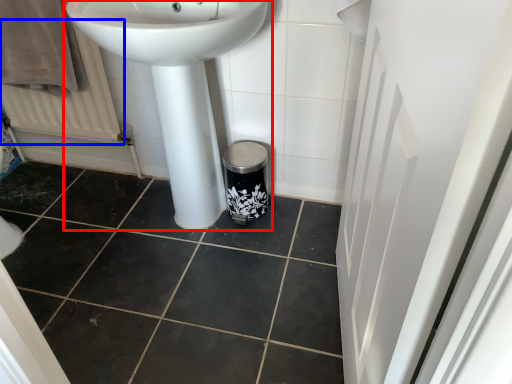
Question: Which object is further to the camera taking this photo, sink (highlighted by a red box) or radiator (highlighted by a blue box)?

Choices:
 (A) sink
 (B) radiator

Answer: (B)